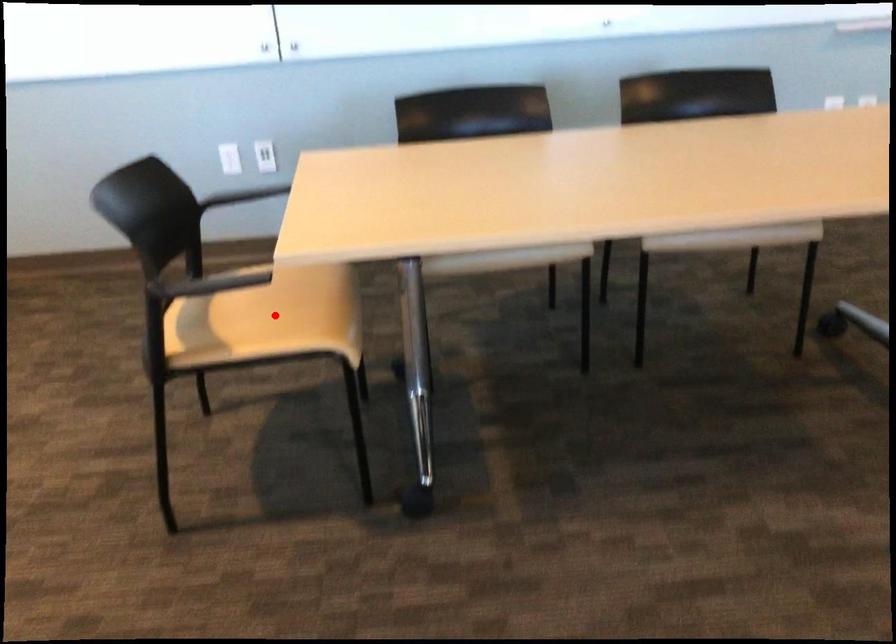
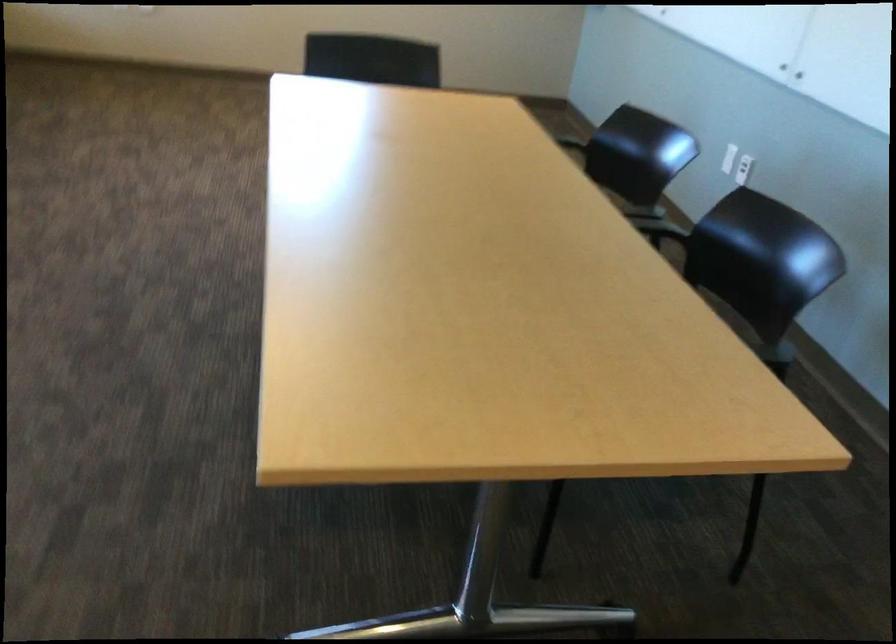
Question: I am providing you with two images of the same scene from different viewpoints. A red point is marked on the first image. At the location where the point appears in image 1, is it still visible in image 2?

Choices:
 (A) Yes
 (B) No

Answer: (B)